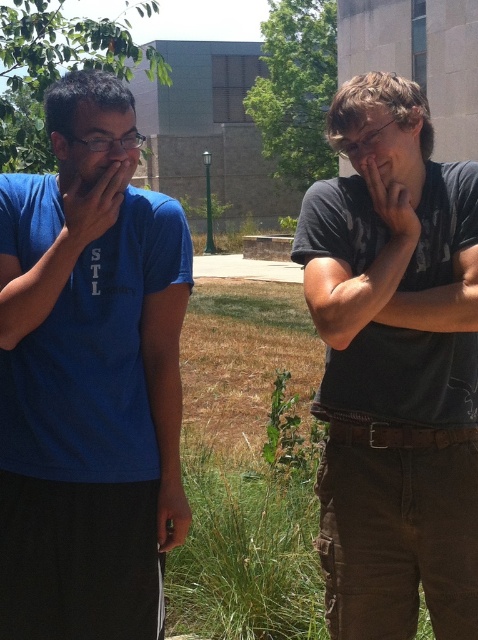
Is point (55, 145) positioned in front of point (110, 225)?

No, (55, 145) is behind (110, 225).

Can you confirm if blue matte t-shirt at left is thinner than matte skin hand at left?

No.

Locate an element on the screen. Image resolution: width=478 pixels, height=640 pixels. blue matte t-shirt at left is located at coordinates (88, 387).

Locate an element on the screen. This screenshot has height=640, width=478. blue matte t-shirt at left is located at coordinates (88, 387).

Which of these two, dark gray t-shirt at center or matte black hand at center, stands shorter?

With less height is matte black hand at center.

The height and width of the screenshot is (640, 478). What do you see at coordinates (394, 372) in the screenshot?
I see `dark gray t-shirt at center` at bounding box center [394, 372].

From the picture: Who is more distant from viewer, (360, 99) or (378, 177)?

A: Positioned behind is point (360, 99).

At what (x,y) coordinates should I click in order to perform the action: click on dark gray t-shirt at center. Please return your answer as a coordinate pair (x, y). The image size is (478, 640). Looking at the image, I should click on (394, 372).

Is point (97, 76) more distant than point (416, 417)?

No, (97, 76) is closer to viewer.

Is point (79, 129) closer to camera compared to point (441, 472)?

Yes, point (79, 129) is closer to viewer.

Where is `blue matte t-shirt at left`? Image resolution: width=478 pixels, height=640 pixels. blue matte t-shirt at left is located at coordinates (88, 387).